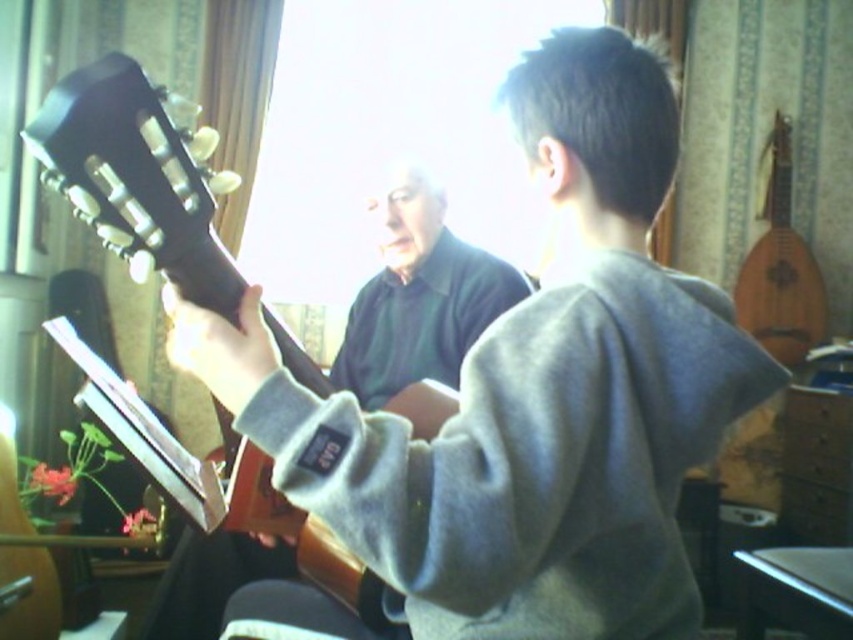
Question: Which point is closer to the camera?

Choices:
 (A) (483, 360)
 (B) (94, 109)

Answer: (A)

Question: In this image, where is gray fleece sweater at center located relative to dark brown wood guitar at left?

Choices:
 (A) above
 (B) below

Answer: (B)

Question: Among these points, which one is farthest from the camera?

Choices:
 (A) (425, 452)
 (B) (144, 84)

Answer: (B)

Question: Is gray fleece sweater at center behind dark brown wood guitar at left?

Choices:
 (A) no
 (B) yes

Answer: (A)

Question: Does gray fleece sweater at center have a greater width compared to dark brown wood guitar at left?

Choices:
 (A) yes
 (B) no

Answer: (A)